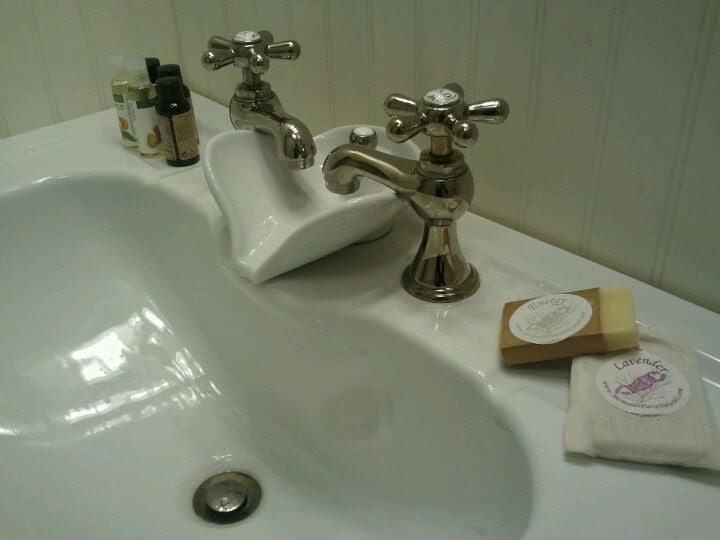
At what (x,y) coordinates should I click in order to perform the action: click on sink bowl. Please return your answer as a coordinate pair (x, y). The image size is (720, 540). Looking at the image, I should click on (109, 382).